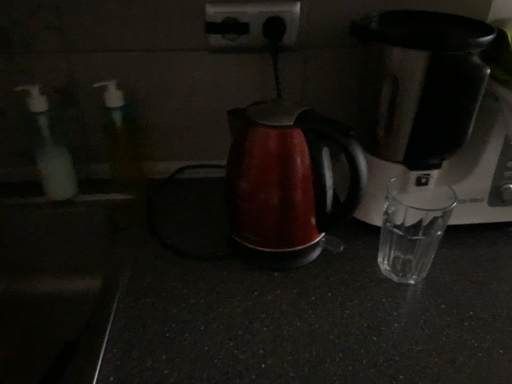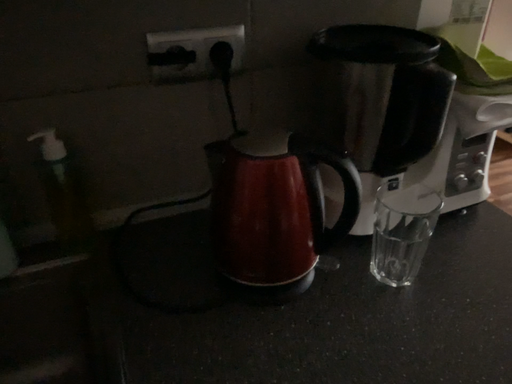
Question: Which way did the camera rotate in the video?

Choices:
 (A) rotated right
 (B) rotated left

Answer: (A)